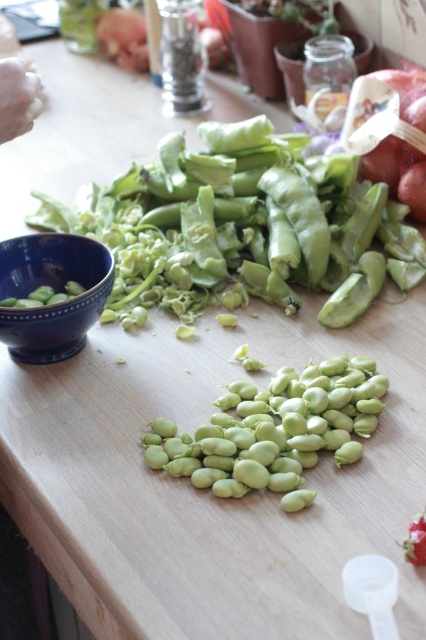
You are a chef preparing a dish and need to know the relative sizes of the objects on the table. Which object is taller, the green matte pod at center or the white flesh hand at upper left?

The green matte pod at center is taller than the white flesh hand at upper left according to the description.

You are a chef preparing ingredients for a recipe. You have a green matte pod at center and green matte fava beans at center on your table. Which object should you use to hold the beans if you need a wider container?

The green matte pod at center is wider than the green matte fava beans at center, so you should use the green matte pod at center to hold the beans.